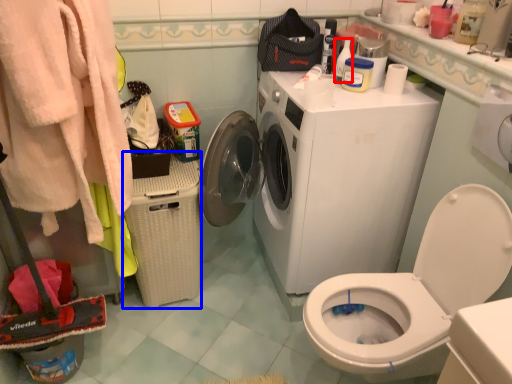
Question: Which of the following is the farthest to the observer, cleaning product (highlighted by a red box) or laundry basket (highlighted by a blue box)?

Choices:
 (A) cleaning product
 (B) laundry basket

Answer: (A)